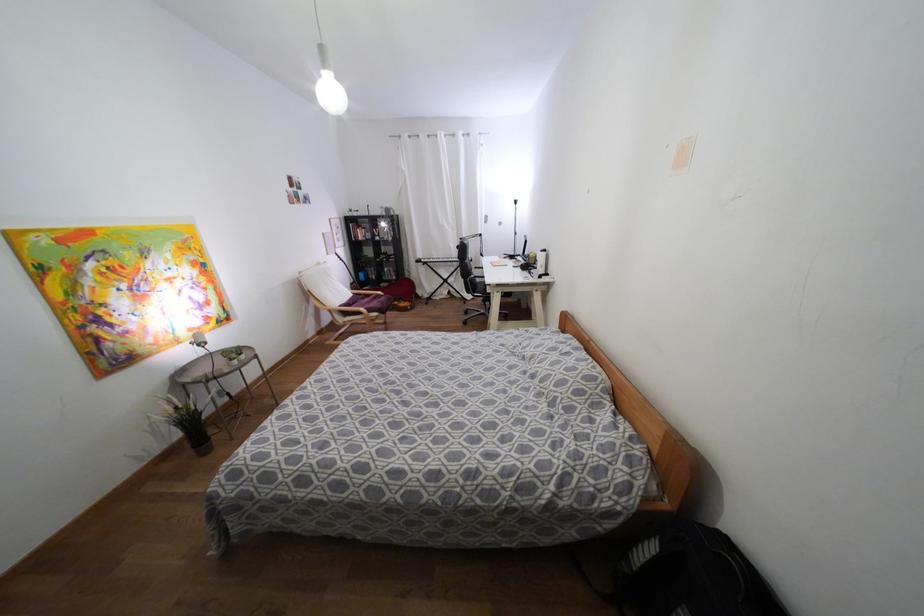
Locate an element on the screen. The image size is (924, 616). office chair sitting surface is located at coordinates (371, 300).